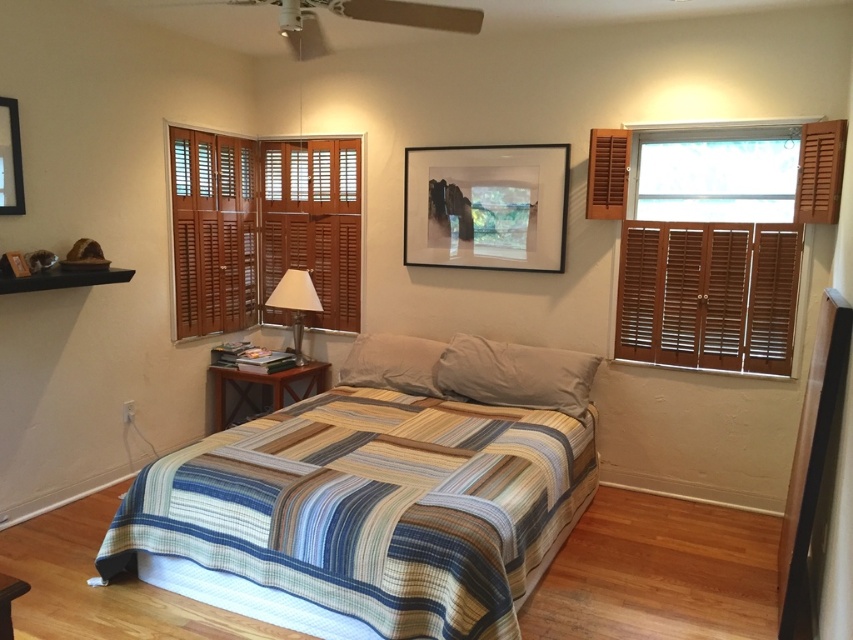
Question: Considering the relative positions of brown wood side table at lower center and wooden shutters at upper right in the image provided, where is brown wood side table at lower center located with respect to wooden shutters at upper right?

Choices:
 (A) left
 (B) right

Answer: (A)

Question: Among these objects, which one is farthest from the camera?

Choices:
 (A) wooden shutters at left
 (B) matte black picture frame at upper left
 (C) wooden shutters at right

Answer: (A)

Question: Is brown wooden shutter at upper right bigger than matte black picture frame at upper left?

Choices:
 (A) no
 (B) yes

Answer: (B)

Question: Which object is closer to the camera taking this photo?

Choices:
 (A) white matte pillow at center
 (B) wooden shutters at upper right

Answer: (B)

Question: Can you confirm if wooden shutters at right is smaller than wooden shutters at upper right?

Choices:
 (A) no
 (B) yes

Answer: (A)

Question: Among these objects, which one is farthest from the camera?

Choices:
 (A) gray fabric pillow at center
 (B) striped quilted bed at center

Answer: (A)